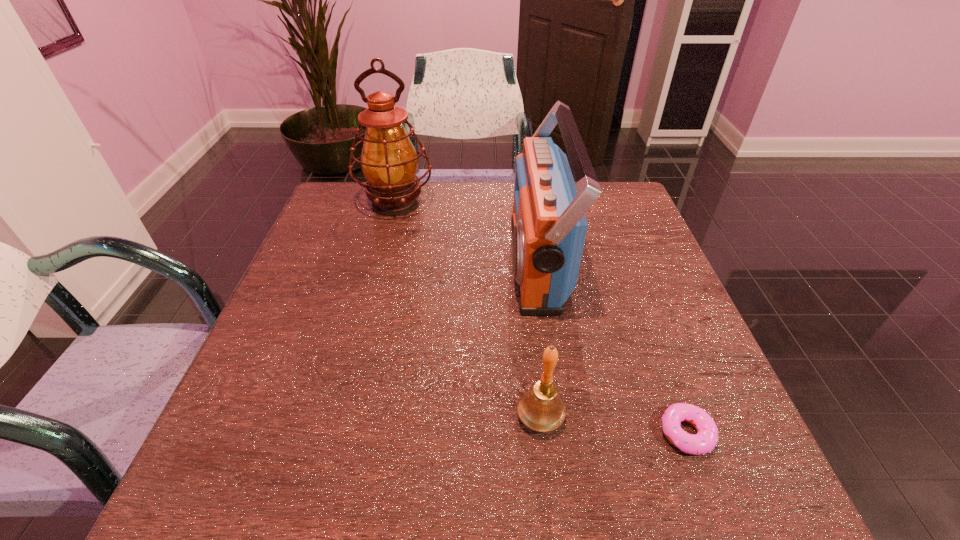
Image resolution: width=960 pixels, height=540 pixels. In order to click on vacant space that satisfies the following two spatial constraints: 1. on the front-facing side of the shortest object; 2. on the left side of the radio receiver in this screenshot , I will do `click(563, 433)`.

You are a GUI agent. You are given a task and a screenshot of the screen. Output one action in this format:
    pyautogui.click(x=<x>, y=<y>)
    Task: Click on the blank space that satisfies the following two spatial constraints: 1. on the front side of the shortest object; 2. on the right side of the oil lamp
    This screenshot has width=960, height=540.
    Given the screenshot: What is the action you would take?
    pyautogui.click(x=336, y=433)

You are a GUI agent. You are given a task and a screenshot of the screen. Output one action in this format:
    pyautogui.click(x=<x>, y=<y>)
    Task: Click on the free space that satisfies the following two spatial constraints: 1. on the front side of the tallest object; 2. on the right side of the second shortest object
    This screenshot has height=540, width=960.
    Given the screenshot: What is the action you would take?
    pyautogui.click(x=341, y=416)

At what (x,y) coordinates should I click in order to perform the action: click on vacant point that satisfies the following two spatial constraints: 1. on the front side of the tallest object; 2. on the right side of the second shortest object. Please return your answer as a coordinate pair (x, y). This screenshot has height=540, width=960. Looking at the image, I should click on (341, 416).

Where is `vacant space that satisfies the following two spatial constraints: 1. on the front-facing side of the second tallest object; 2. on the right side of the rightmost object`? vacant space that satisfies the following two spatial constraints: 1. on the front-facing side of the second tallest object; 2. on the right side of the rightmost object is located at coordinates (563, 433).

Locate an element on the screen. Image resolution: width=960 pixels, height=540 pixels. free location that satisfies the following two spatial constraints: 1. on the front side of the second shortest object; 2. on the right side of the tallest object is located at coordinates (341, 416).